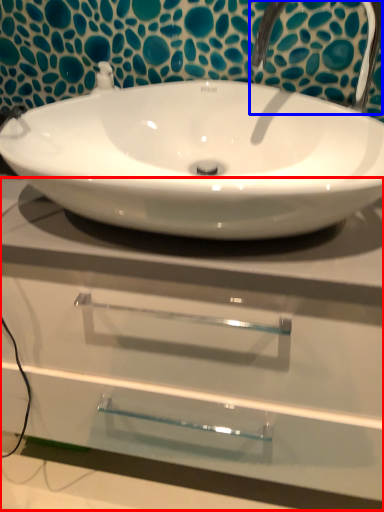
Question: Which object appears closest to the camera in this image, counter top (highlighted by a red box) or plumbing fixture (highlighted by a blue box)?

Choices:
 (A) counter top
 (B) plumbing fixture

Answer: (A)